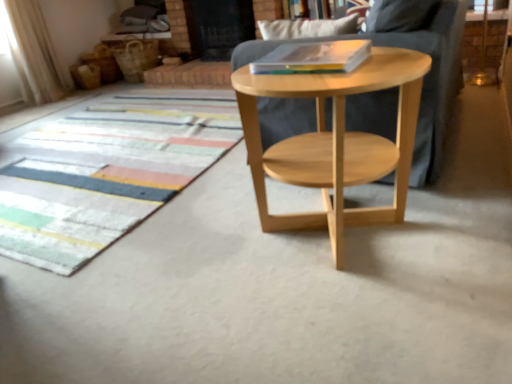
Question: Is multicolored woven mat at lower left in front of or behind transparent glass screen door at upper center in the image?

Choices:
 (A) front
 (B) behind

Answer: (A)

Question: In terms of width, does multicolored woven mat at lower left look wider or thinner when compared to transparent glass screen door at upper center?

Choices:
 (A) wide
 (B) thin

Answer: (A)

Question: Estimate the real-world distances between objects in this image. Which object is closer to the transparent glass screen door at upper center?

Choices:
 (A) natural wood side table at center
 (B) multicolored woven mat at lower left
 (C) natural wood side table at center
 (D) hardcover book at center
 (E) sheer fabric curtain at upper left

Answer: (E)

Question: Estimate the real-world distances between objects in this image. Which object is closer to the natural wood side table at center?

Choices:
 (A) transparent glass screen door at upper center
 (B) multicolored woven mat at lower left
 (C) hardcover book at center
 (D) natural wood side table at center
 (E) sheer fabric curtain at upper left

Answer: (D)